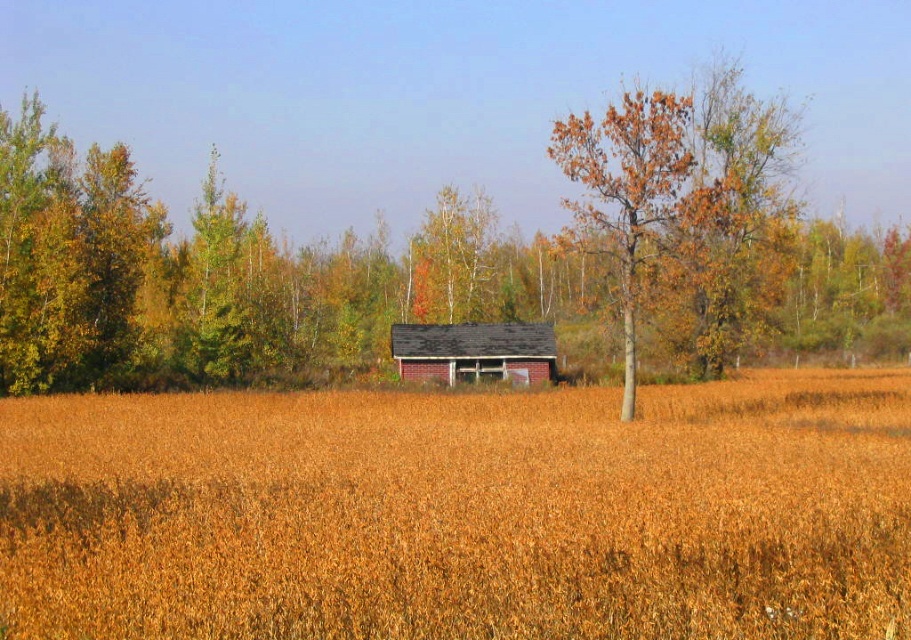
You are a farmer checking the crops and notice the brown matte wheat field at center and the brown textured tree at center. Which one is located to the left of the other?

The brown matte wheat field at center is positioned on the left side of brown textured tree at center.

You are standing in the field of golden crops looking towards the old building. There are two points marked in the image. Which point, point 1 at coordinates (215,634) or point 2 at coordinates (688,198), is closer to you?

Point 1 at coordinates (215,634) is closer to the viewer than point 2 at coordinates (688,198).